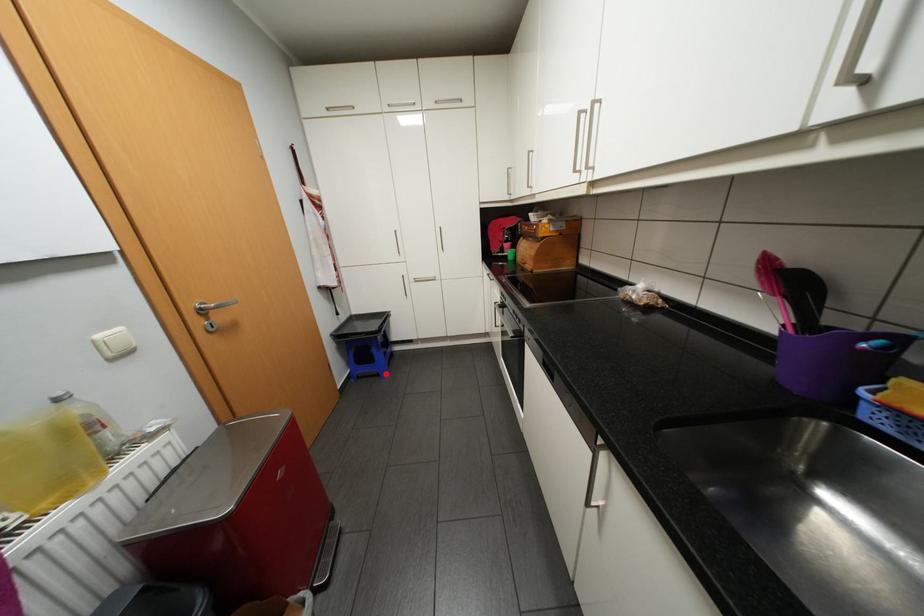
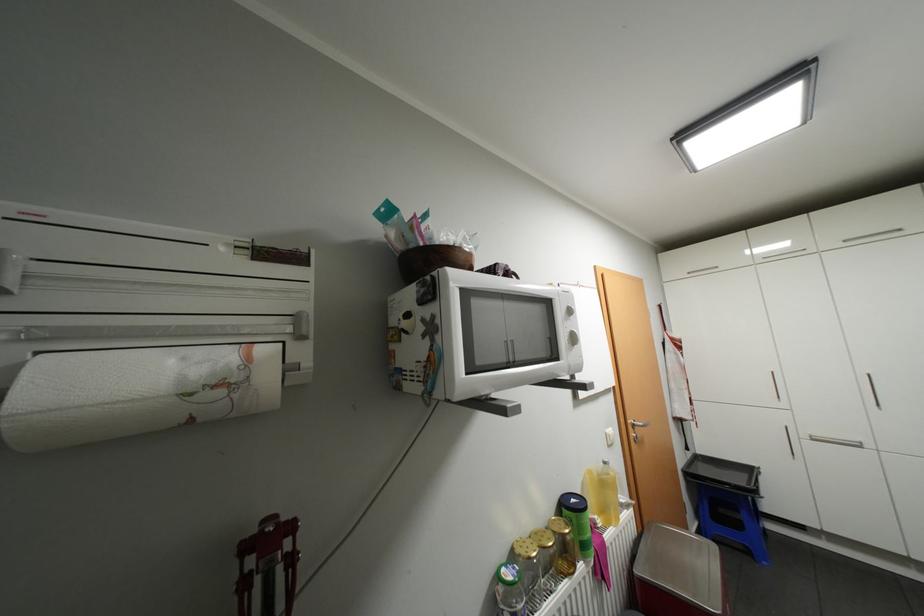
The point at the highlighted location is marked in the first image. Where is the corresponding point in the second image?

(756, 552)